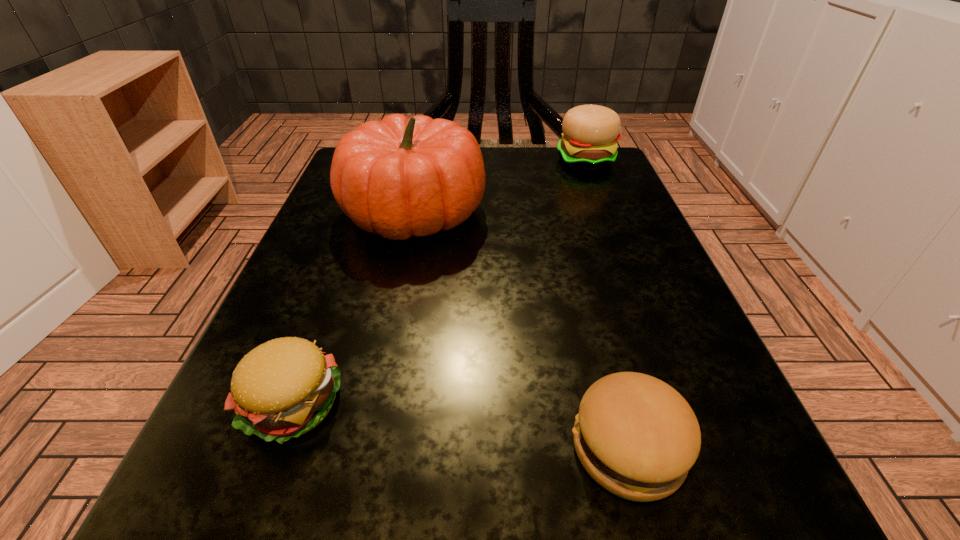
Where is `object positioned at the near edge`? The width and height of the screenshot is (960, 540). object positioned at the near edge is located at coordinates (637, 437).

At what (x,y) coordinates should I click in order to perform the action: click on pumpkin situated at the left edge. Please return your answer as a coordinate pair (x, y). Looking at the image, I should click on (399, 177).

Where is `hamburger present at the left edge`? The height and width of the screenshot is (540, 960). hamburger present at the left edge is located at coordinates (283, 388).

Find the location of `object positioned at the far left corner`. object positioned at the far left corner is located at coordinates (399, 177).

Locate an element on the screen. The image size is (960, 540). object that is at the far right corner is located at coordinates click(x=590, y=133).

Find the location of a particular element. object that is at the near right corner is located at coordinates (637, 437).

This screenshot has height=540, width=960. In the image, there is a desktop. What are the coordinates of `free region at the left edge` in the screenshot? It's located at (284, 284).

Where is `vacant space at the right edge`? The width and height of the screenshot is (960, 540). vacant space at the right edge is located at coordinates (575, 256).

This screenshot has height=540, width=960. What are the coordinates of `vacant area at the near left corner` in the screenshot? It's located at (309, 474).

Locate an element on the screen. The image size is (960, 540). free space at the near right corner is located at coordinates (627, 531).